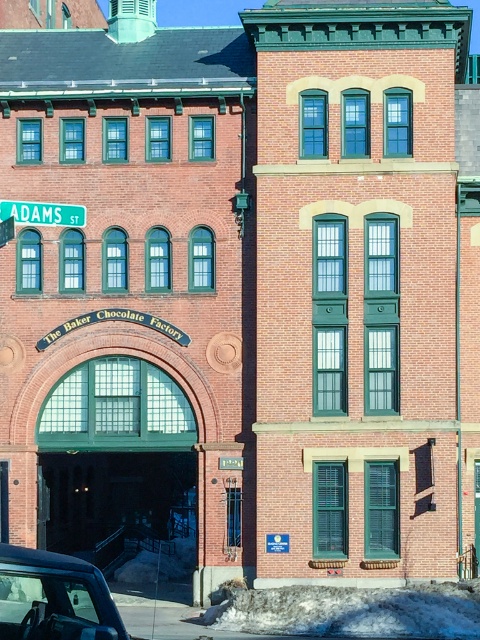
Is point (113, 612) less distant than point (64, 209)?

Yes, point (113, 612) is in front of point (64, 209).

Between metallic gray car at lower left and green plastic street sign at upper left, which one appears on the left side from the viewer's perspective?

green plastic street sign at upper left

Is point (60, 589) positioned after point (73, 221)?

No, it is not.

Locate an element on the screen. metallic gray car at lower left is located at coordinates (54, 596).